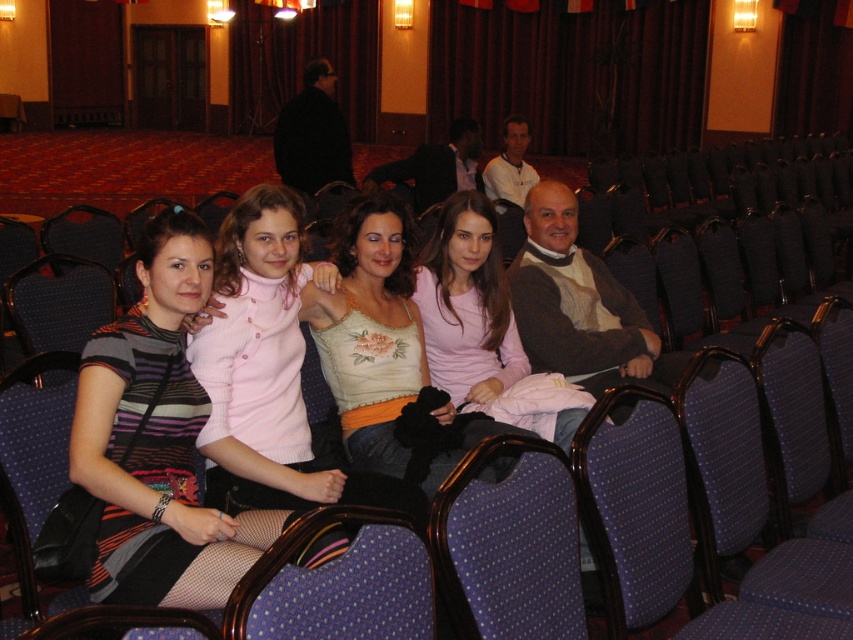
Question: Is striped fabric dress at center below pink knitted sweater at center?

Choices:
 (A) no
 (B) yes

Answer: (B)

Question: Which of the following is the farthest from the observer?

Choices:
 (A) pink fabric shirt at center
 (B) striped fabric dress at center

Answer: (A)

Question: Does matte floral tank top at center appear over pink fabric shirt at center?

Choices:
 (A) yes
 (B) no

Answer: (B)

Question: Estimate the real-world distances between objects in this image. Which object is closer to the matte floral tank top at center?

Choices:
 (A) pink knitted sweater at center
 (B) striped fabric dress at center

Answer: (A)

Question: Among these objects, which one is nearest to the camera?

Choices:
 (A) matte floral tank top at center
 (B) blue dotted fabric chair at center
 (C) pink fabric shirt at center

Answer: (B)

Question: Does pink knitted sweater at center appear on the left side of blue dotted fabric chair at center?

Choices:
 (A) yes
 (B) no

Answer: (A)